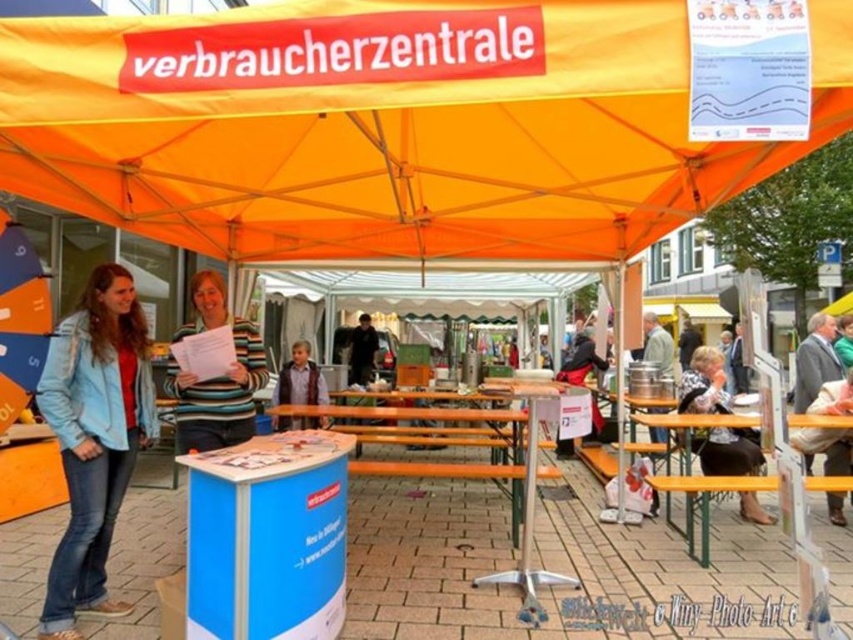
Based on the photo, you are standing at the entrance of the verbraucherzentrale event and want to locate the blue cardboard table at center. Which direction should you look relative to the orange fabric canopy at upper center?

Result: You should look to the right of the orange fabric canopy at upper center to find the blue cardboard table at center because the orange fabric canopy at upper center is to the left of blue cardboard table at center.

You are standing at the point marked as point (387, 125) in the image. What object are you currently standing on?

You are standing on the orange fabric canopy at upper center.

You are standing at the center of the event area and want to locate the orange fabric umbrella at left. In which direction should you look to find it?

The orange fabric umbrella at left is located at point 0.445 on the x axis and 0.026 on the y axis, so you should look to the left side of the event area to find it.